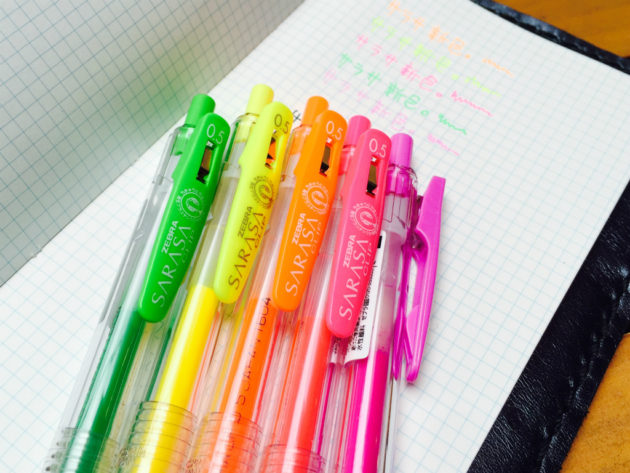
At what (x,y) coordinates should I click in order to perform the action: click on pens. Please return your answer as a coordinate pair (x, y). This screenshot has height=473, width=630. Looking at the image, I should click on (113, 371), (173, 349), (246, 350), (305, 369), (375, 398).